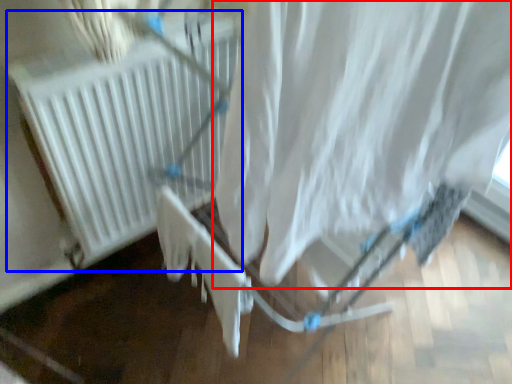
Question: Which of the following is the closest to the observer, curtain (highlighted by a red box) or heater (highlighted by a blue box)?

Choices:
 (A) curtain
 (B) heater

Answer: (A)